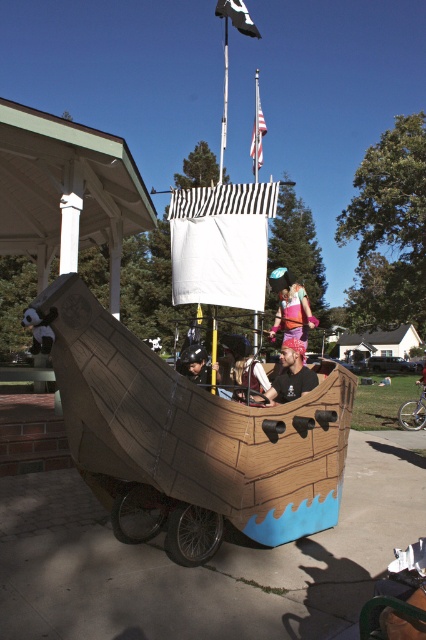
You are a pirate captain navigating your cardboard ship. You notice a white fabric flag at center. Where is this flag positioned relative to the ship?

The white fabric flag at center is located at point (221, 243) on the ship, which places it near the middle section slightly towards the front.

You are standing in front of the pirate ship and want to place a new treasure chest exactly where the matte black helmet at center is currently located. Is this location on the ship or on the ground?

The matte black helmet at center is located at point (195, 365), which is on the ship since it is positioned on the ship structure and not on the ground.

You are a costume designer observing the pirate ship scene. You need to decide which item is narrower between the white fabric flag at center and the pink fabric dress at center. Which one is it?

The white fabric flag at center has a lesser width compared to the pink fabric dress at center, so the white fabric flag at center is narrower.